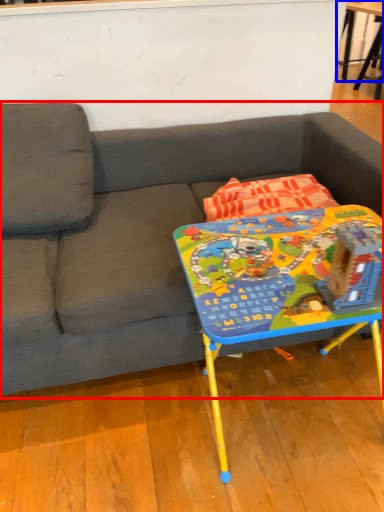
Question: Among these objects, which one is farthest to the camera, studio couch (highlighted by a red box) or table (highlighted by a blue box)?

Choices:
 (A) studio couch
 (B) table

Answer: (B)